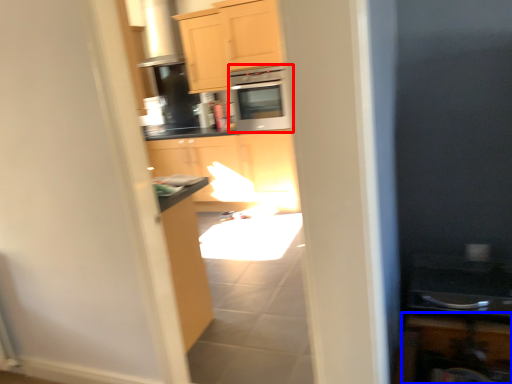
Question: Which object appears closest to the camera in this image, microwave oven (highlighted by a red box) or cabinetry (highlighted by a blue box)?

Choices:
 (A) microwave oven
 (B) cabinetry

Answer: (B)